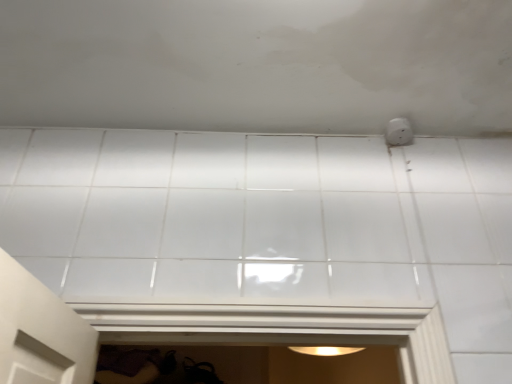
This screenshot has width=512, height=384. What do you see at coordinates (399, 132) in the screenshot?
I see `white plastic electric outlet at upper right` at bounding box center [399, 132].

This screenshot has height=384, width=512. I want to click on white plastic electric outlet at upper right, so click(399, 132).

Where is `white plastic electric outlet at upper right`? white plastic electric outlet at upper right is located at coordinates point(399,132).